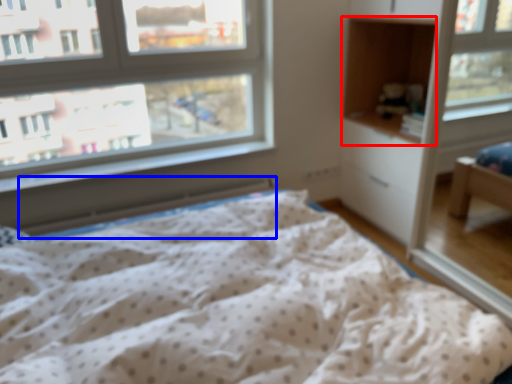
Question: Among these objects, which one is farthest to the camera, cabinet (highlighted by a red box) or radiator (highlighted by a blue box)?

Choices:
 (A) cabinet
 (B) radiator

Answer: (B)